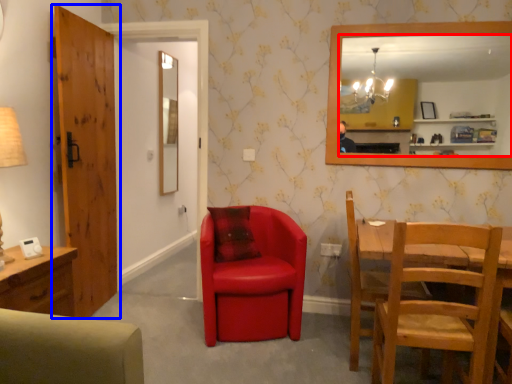
Question: Which of the following is the closest to the observer, mirror (highlighted by a red box) or door (highlighted by a blue box)?

Choices:
 (A) mirror
 (B) door

Answer: (B)